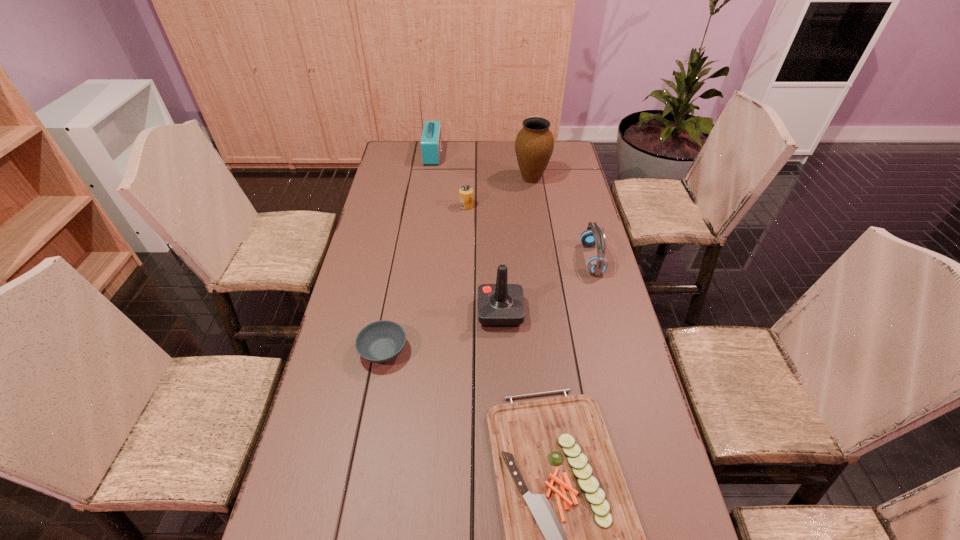
Identify the location of object located in the far edge section of the desktop. (431, 141).

Find the location of a particular element. This screenshot has width=960, height=540. object present at the left edge is located at coordinates (381, 341).

The height and width of the screenshot is (540, 960). Find the location of `urn that is at the right edge`. urn that is at the right edge is located at coordinates (534, 144).

The image size is (960, 540). What are the coordinates of `headset positioned at the right edge` in the screenshot? It's located at (593, 235).

Image resolution: width=960 pixels, height=540 pixels. What are the coordinates of `free point at the far edge` in the screenshot? It's located at (480, 140).

I want to click on vacant space at the left edge, so click(x=384, y=315).

You are a GUI agent. You are given a task and a screenshot of the screen. Output one action in this format:
    pyautogui.click(x=<x>, y=<y>)
    Task: Click on the vacant space at the right edge of the desktop
    This screenshot has height=540, width=960.
    Given the screenshot: What is the action you would take?
    pyautogui.click(x=605, y=410)

The image size is (960, 540). Identify the location of vacant area at the far left corner of the desktop. (404, 158).

Locate an element on the screen. The image size is (960, 540). free spot between the tallest object and the joystick is located at coordinates [x=467, y=233].

At what (x,y) coordinates should I click in order to perform the action: click on free spot between the fourth tallest object and the urn. Please return your answer as a coordinate pair (x, y). The width and height of the screenshot is (960, 540). Looking at the image, I should click on [x=562, y=219].